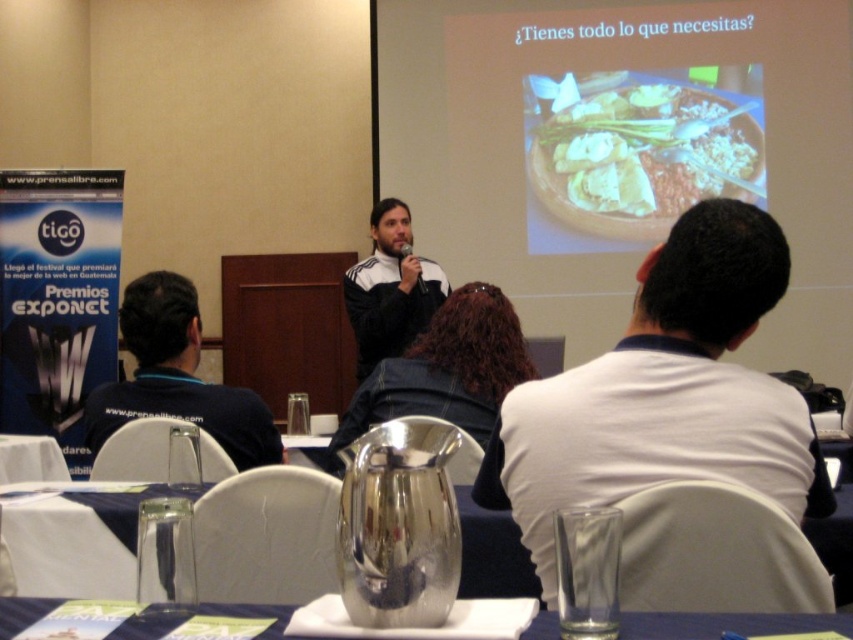
Question: Can you confirm if brown matte plate at upper center is smaller than dark blue shirt at left?

Choices:
 (A) no
 (B) yes

Answer: (A)

Question: Does brown matte plate at upper center come in front of white fleece jacket at center?

Choices:
 (A) yes
 (B) no

Answer: (B)

Question: Is white fleece jacket at center further to the viewer compared to metallic silver pitcher at center?

Choices:
 (A) no
 (B) yes

Answer: (B)

Question: Among these points, which one is nearest to the camera?

Choices:
 (A) (96, 401)
 (B) (471, 589)

Answer: (B)

Question: Considering the real-world distances, which object is closest to the brown matte plate at upper center?

Choices:
 (A) white fleece jacket at center
 (B) metallic silver pitcher at center
 (C) dark blue shirt at left
 (D) metallic silver pitcher at lower center

Answer: (A)

Question: Which object is the farthest from the brown matte plate at upper center?

Choices:
 (A) metallic silver pitcher at center
 (B) dark blue shirt at left
 (C) white fleece jacket at center

Answer: (A)